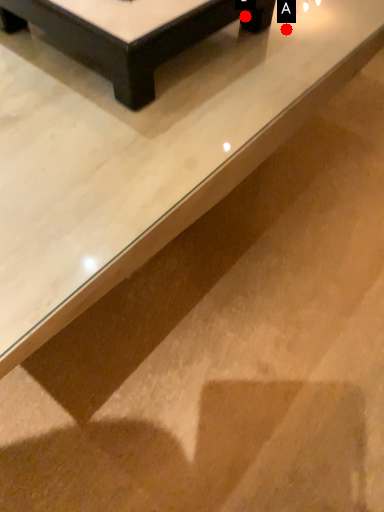
Question: Two points are circled on the image, labeled by A and B beside each circle. Which point is farther from the camera taking this photo?

Choices:
 (A) A is further
 (B) B is further

Answer: (A)